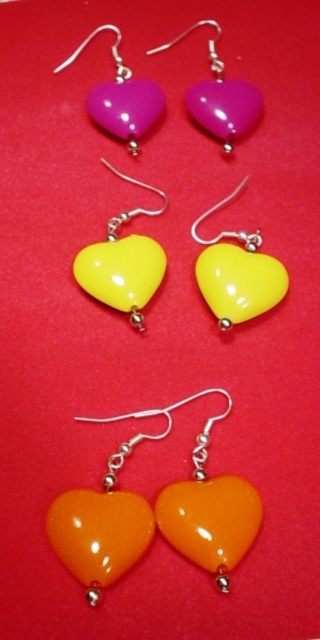
Consider the image. You are holding a magnifying glass to examine the earrings. Which of the two objects, the yellow glossy heart at center or the glossy plastic heart at upper center, appears larger in your view?

The yellow glossy heart at center appears larger because it is closer to the viewer than the glossy plastic heart at upper center.

You are holding a flashlight and want to shine it on the glossy plastic heart at center. If you are standing 1.36 meters away from it, will the light reflect directly back to your eyes?

The glossy plastic heart at center and viewer are 1.36 meters apart. Since the surface is glossy and reflective, the light from the flashlight will reflect directly back to your eyes when shone at the correct angle.

You are an earring organizer who needs to place the glossy plastic heart at center and the purple glossy heart at upper center into a display case. Which of the two hearts is located to the right of the other?

The glossy plastic heart at center is positioned on the right side of purple glossy heart at upper center.